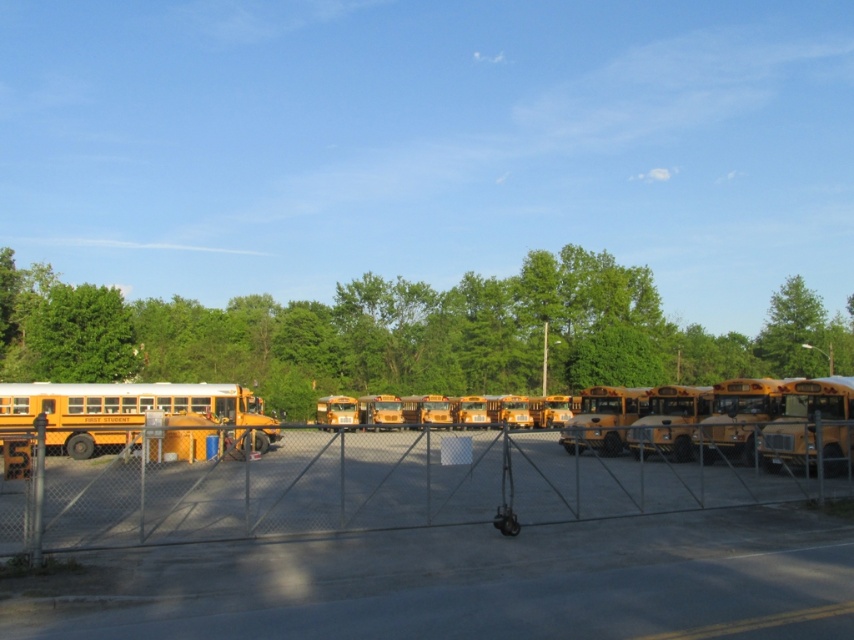
Between metallic chain-link fence at center and matte yellow school bus at left, which one has more height?

With more height is metallic chain-link fence at center.

Between metallic chain-link fence at center and matte yellow school bus at left, which one appears on the right side from the viewer's perspective?

From the viewer's perspective, metallic chain-link fence at center appears more on the right side.

Between point (130, 477) and point (25, 419), which one is positioned behind?

The point (25, 419) is more distant.

Identify the location of metallic chain-link fence at center. (383, 486).

Is metallic chain-link fence at center to the right of yellow matte school bus at right from the viewer's perspective?

In fact, metallic chain-link fence at center is to the left of yellow matte school bus at right.

Between metallic chain-link fence at center and yellow matte school bus at right, which one appears on the left side from the viewer's perspective?

metallic chain-link fence at center is more to the left.

What do you see at coordinates (383, 486) in the screenshot? I see `metallic chain-link fence at center` at bounding box center [383, 486].

Identify the location of metallic chain-link fence at center. pyautogui.click(x=383, y=486).

Is matte yellow school bus at left to the left of yellow matte school bus at right from the viewer's perspective?

Indeed, matte yellow school bus at left is positioned on the left side of yellow matte school bus at right.

Can you confirm if matte yellow school bus at left is positioned to the right of yellow matte school bus at right?

In fact, matte yellow school bus at left is to the left of yellow matte school bus at right.

Is point (73, 387) in front of point (798, 449)?

No, (73, 387) is further to viewer.

The height and width of the screenshot is (640, 854). I want to click on matte yellow school bus at left, so (x=124, y=410).